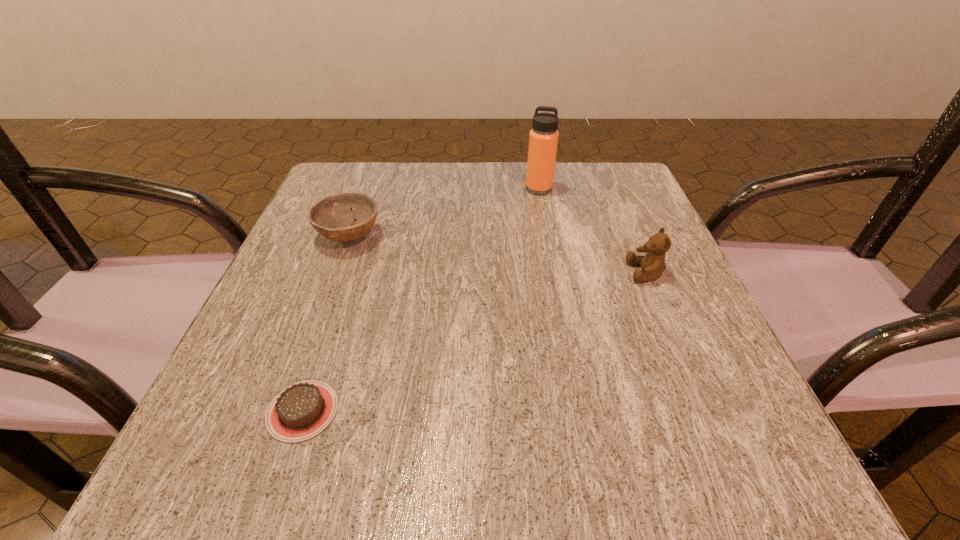
What are the coordinates of `free region located 0.110m on the front-facing side of the third shortest object` in the screenshot? It's located at (568, 273).

Identify the location of vacant space located 0.070m on the front-facing side of the third shortest object. The width and height of the screenshot is (960, 540). click(590, 273).

Locate an element on the screen. The width and height of the screenshot is (960, 540). free space located 0.050m on the front of the third nearest object is located at coordinates (335, 274).

Identify the location of vacant space situated on the left of the shortest object. The height and width of the screenshot is (540, 960). (210, 411).

Image resolution: width=960 pixels, height=540 pixels. I want to click on object located at the far edge, so click(543, 139).

In order to click on object present at the near edge in this screenshot , I will do `click(302, 410)`.

At what (x,y) coordinates should I click in order to perform the action: click on bowl at the left edge. Please return your answer as a coordinate pair (x, y). The image size is (960, 540). Looking at the image, I should click on (333, 217).

I want to click on chocolate cake that is at the left edge, so click(x=302, y=410).

Identify the location of object located at the right edge. (652, 263).

This screenshot has height=540, width=960. I want to click on object present at the near left corner, so click(302, 410).